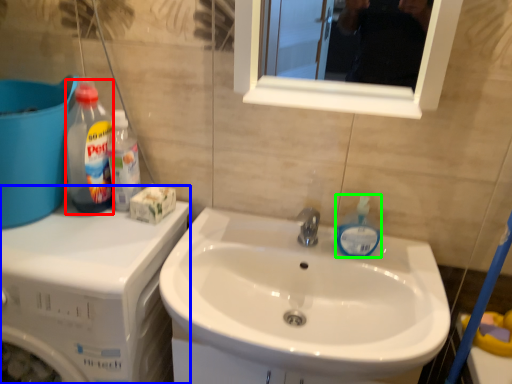
Question: Based on their relative distances, which object is farther from cleaning product (highlighted by a red box)? Choose from dish washer (highlighted by a blue box) and cleaning product (highlighted by a green box).

Choices:
 (A) dish washer
 (B) cleaning product

Answer: (B)